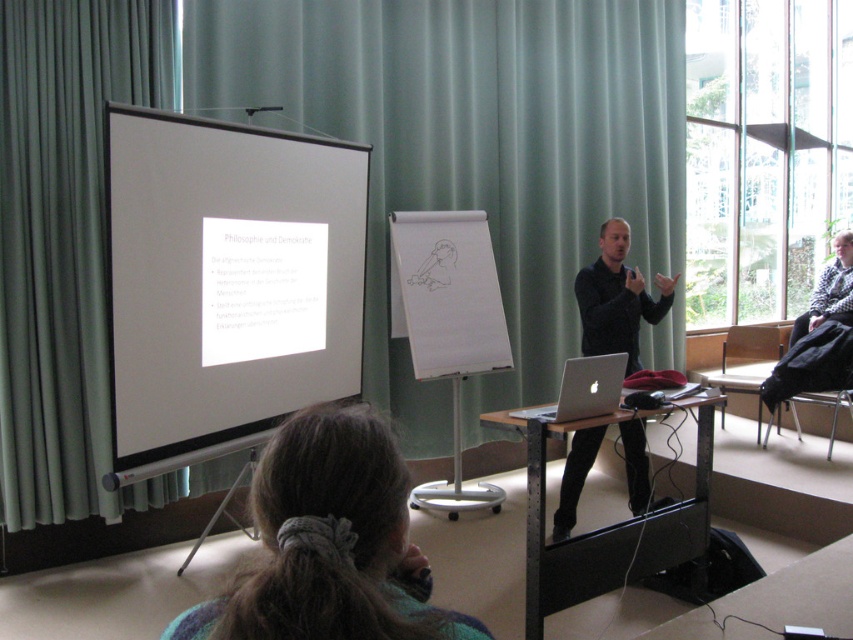
Question: Is white glossy projection screen at upper left above dark brown hair at lower center?

Choices:
 (A) no
 (B) yes

Answer: (B)

Question: Among these points, which one is nearest to the camera?

Choices:
 (A) (346, 387)
 (B) (276, 454)
 (C) (631, 294)
 (D) (572, 388)

Answer: (B)

Question: Does dark brown hair at lower center appear on the left side of black matte shirt at center?

Choices:
 (A) yes
 (B) no

Answer: (A)

Question: Which point appears closest to the camera in this image?

Choices:
 (A) 366,628
 (B) 567,413
 (C) 323,371
 (D) 590,332

Answer: (A)

Question: Which object is the closest to the dark brown hair at lower center?

Choices:
 (A) silver metallic laptop at center
 (B) black matte shirt at center
 (C) white glossy projection screen at upper left

Answer: (A)

Question: Is white glossy projection screen at upper left positioned behind dark brown hair at lower center?

Choices:
 (A) yes
 (B) no

Answer: (A)